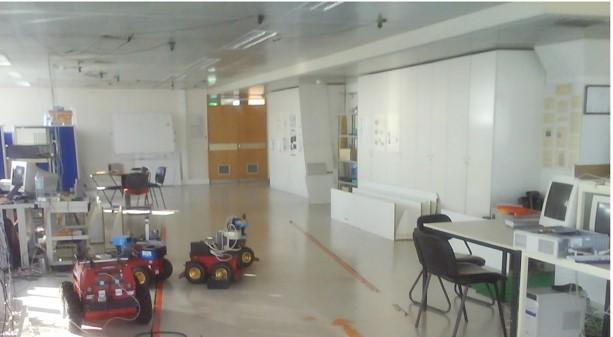
The image size is (613, 337). What are the coordinates of `vents` in the screenshot? It's located at (223, 167), (254, 168).